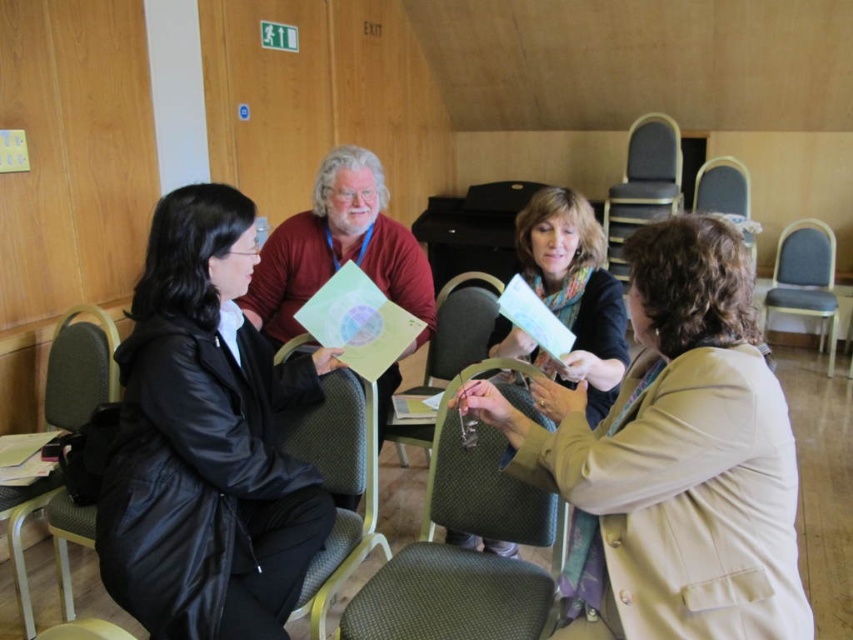
You are organizing a meeting in this conference room and need to place a name tag on the table in front of the beige fabric jacket at center and the gray fabric chair at right. Which object should you place the name tag closer to if you want it to be directly between them?

The beige fabric jacket at center is to the left of the gray fabric chair at right, so placing the name tag closer to the beige fabric jacket at center would position it directly between them.

You are organizing a storage space and need to stack items vertically. You have the black leather jacket at left and the green fabric chair at center. Which item can be placed on top of the other without exceeding the thickness limit?

The black leather jacket at left is thinner than the green fabric chair at center, so it can be placed on top of the chair without exceeding the thickness limit.